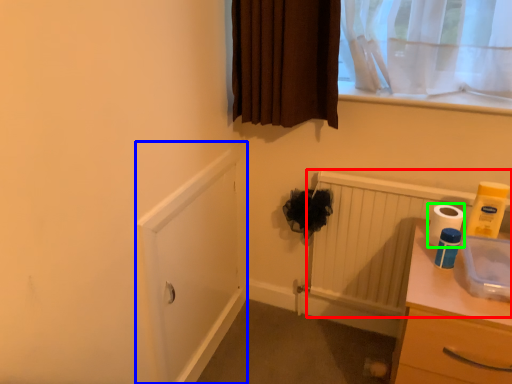
Question: Estimate the real-world distances between objects in this image. Which object is farther from radiator (highlighted by a red box), screen door (highlighted by a blue box) or toilet paper (highlighted by a green box)?

Choices:
 (A) screen door
 (B) toilet paper

Answer: (A)